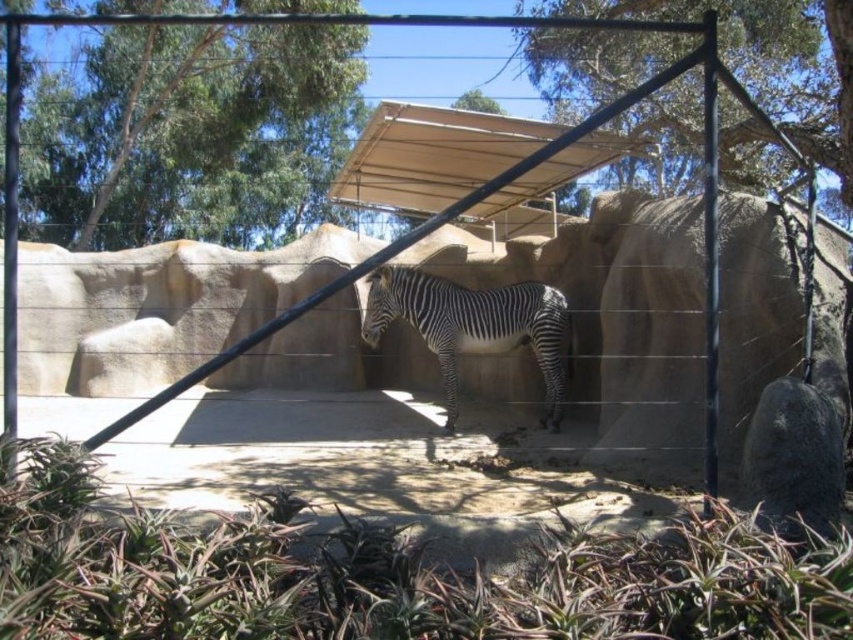
Question: Which point is farther from the camera taking this photo?

Choices:
 (A) tap(537, 193)
 (B) tap(519, 8)
 (C) tap(42, 170)

Answer: (C)

Question: Among these objects, which one is nearest to the camera?

Choices:
 (A) green leafy tree at upper left
 (B) black and white striped zebra at center
 (C) beige fabric canopy at center
 (D) green leafy tree at upper center

Answer: (C)

Question: Can you confirm if green leafy tree at upper left is positioned above black and white striped zebra at center?

Choices:
 (A) no
 (B) yes

Answer: (B)

Question: Does beige fabric canopy at center appear under black and white striped zebra at center?

Choices:
 (A) yes
 (B) no

Answer: (B)

Question: Does green leafy tree at upper left come in front of beige fabric canopy at center?

Choices:
 (A) no
 (B) yes

Answer: (A)

Question: Which of the following is the farthest from the observer?

Choices:
 (A) (325, 99)
 (B) (415, 161)

Answer: (A)